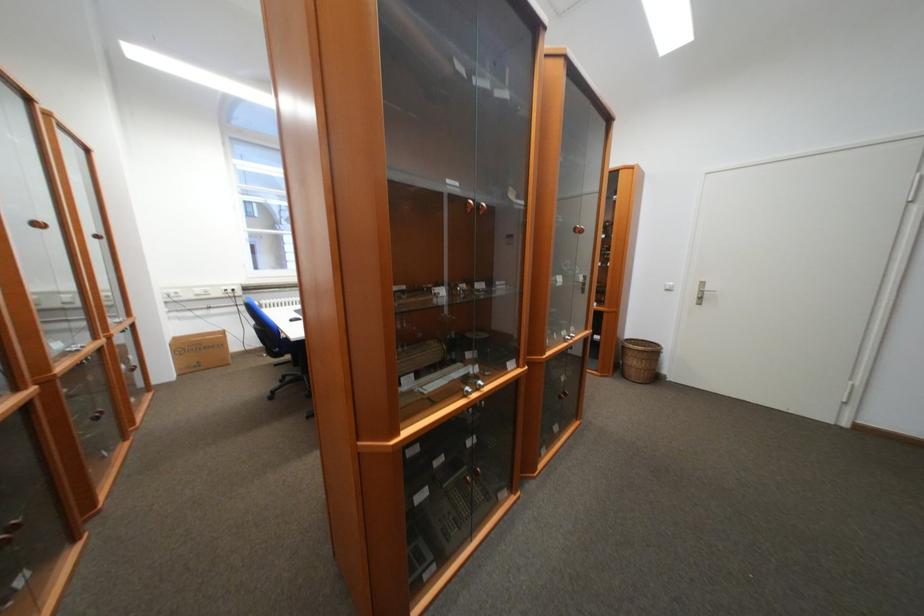
The height and width of the screenshot is (616, 924). Identify the location of silver door handle. (701, 292).